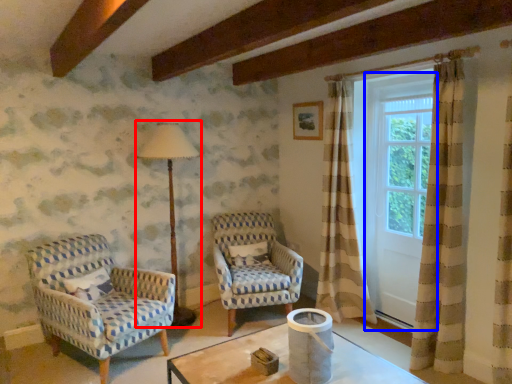
Question: Among these objects, which one is farthest to the camera, table lamp (highlighted by a red box) or screen door (highlighted by a blue box)?

Choices:
 (A) table lamp
 (B) screen door

Answer: (A)